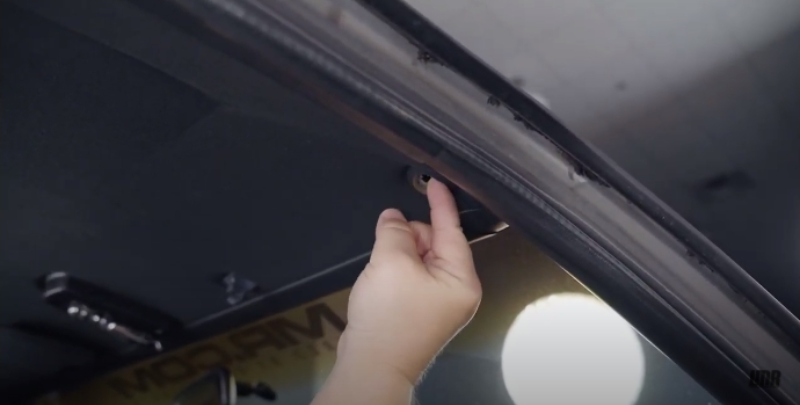
At what (x,y) coordinates should I click in order to perform the action: click on bright round lamp light. Please return your answer as a coordinate pair (x, y). Looking at the image, I should click on (558, 352).